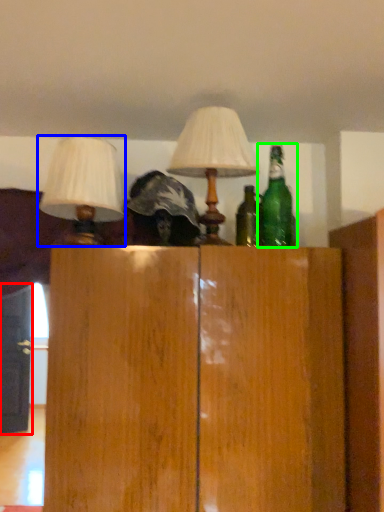
Question: Which is farther away from door (highlighted by a red box)? lamp (highlighted by a blue box) or bottle (highlighted by a green box)?

Choices:
 (A) lamp
 (B) bottle

Answer: (B)